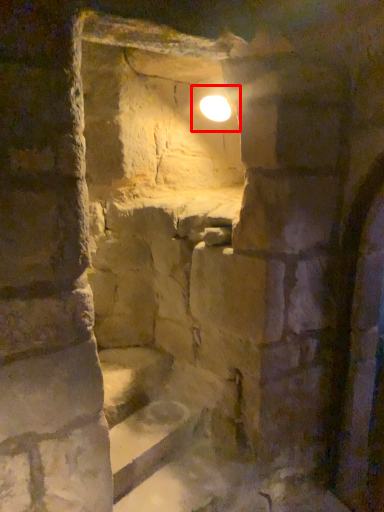
Question: From the image's perspective, what is the correct spatial positioning of light (annotated by the red box) in reference to stairs?

Choices:
 (A) below
 (B) above

Answer: (B)